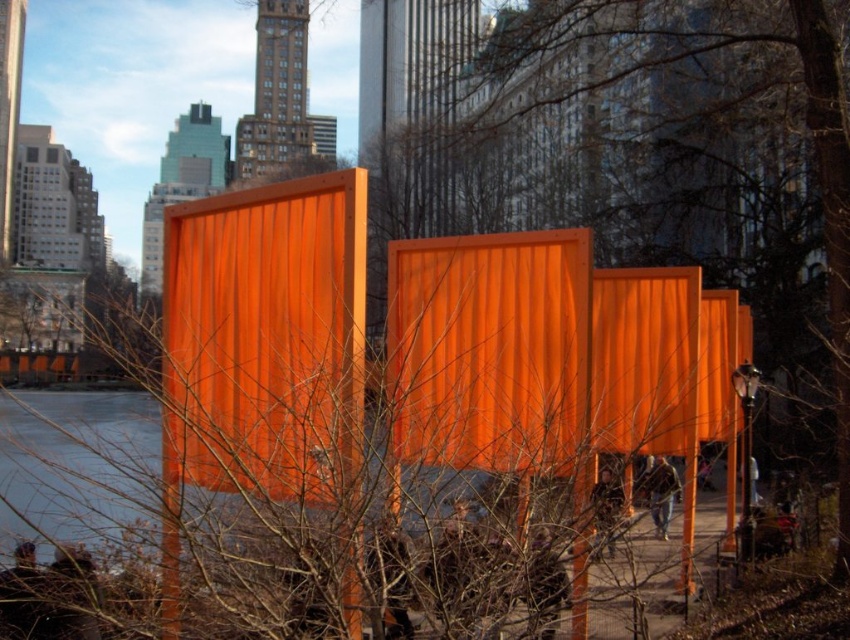
Question: Can you confirm if orange corrugated metal at center is positioned below orange corrugated metal shipping container at center?

Choices:
 (A) no
 (B) yes

Answer: (A)

Question: Does orange corrugated metal at center appear on the right side of orange corrugated metal shipping container at center?

Choices:
 (A) yes
 (B) no

Answer: (A)

Question: Which of the following is the closest to the observer?

Choices:
 (A) (187, 252)
 (B) (604, 360)

Answer: (A)

Question: Considering the relative positions of orange corrugated metal at center and orange corrugated metal shipping container at center in the image provided, where is orange corrugated metal at center located with respect to orange corrugated metal shipping container at center?

Choices:
 (A) below
 (B) above

Answer: (B)

Question: Which point is closer to the camera?

Choices:
 (A) (252, 333)
 (B) (554, 179)

Answer: (A)